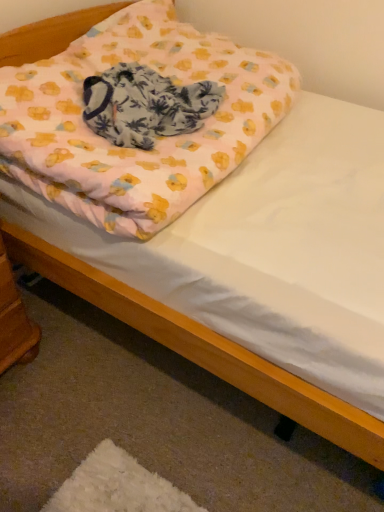
Question: From a real-world perspective, is pink fabric pillow at upper center physically above wooden changing table at lower left?

Choices:
 (A) no
 (B) yes

Answer: (B)

Question: Is pink fabric pillow at upper center not close to wooden changing table at lower left?

Choices:
 (A) yes
 (B) no

Answer: (B)

Question: Can you confirm if pink fabric pillow at upper center is thinner than wooden changing table at lower left?

Choices:
 (A) no
 (B) yes

Answer: (A)

Question: Does pink fabric pillow at upper center lie behind wooden changing table at lower left?

Choices:
 (A) yes
 (B) no

Answer: (B)

Question: Does pink fabric pillow at upper center have a greater height compared to wooden changing table at lower left?

Choices:
 (A) yes
 (B) no

Answer: (B)

Question: Considering the positions of pink fabric blanket at center and wooden changing table at lower left in the image, is pink fabric blanket at center taller or shorter than wooden changing table at lower left?

Choices:
 (A) tall
 (B) short

Answer: (B)

Question: Is pink fabric blanket at center wider or thinner than wooden changing table at lower left?

Choices:
 (A) wide
 (B) thin

Answer: (A)

Question: From a real-world perspective, relative to wooden changing table at lower left, is pink fabric blanket at center vertically above or below?

Choices:
 (A) below
 (B) above

Answer: (B)

Question: From the image's perspective, is pink fabric blanket at center located above or below wooden changing table at lower left?

Choices:
 (A) below
 (B) above

Answer: (B)

Question: From a real-world perspective, relative to pink fabric pillow at upper center, is pink fabric blanket at center vertically above or below?

Choices:
 (A) above
 (B) below

Answer: (A)

Question: From their relative heights in the image, would you say pink fabric blanket at center is taller or shorter than pink fabric pillow at upper center?

Choices:
 (A) tall
 (B) short

Answer: (B)

Question: Would you say pink fabric blanket at center is to the left or to the right of pink fabric pillow at upper center in the picture?

Choices:
 (A) left
 (B) right

Answer: (A)

Question: From the image's perspective, is pink fabric blanket at center positioned above or below pink fabric pillow at upper center?

Choices:
 (A) below
 (B) above

Answer: (A)

Question: Is pink fabric pillow at upper center bigger or smaller than wooden changing table at lower left?

Choices:
 (A) small
 (B) big

Answer: (B)

Question: Considering the positions of pink fabric pillow at upper center and wooden changing table at lower left in the image, is pink fabric pillow at upper center wider or thinner than wooden changing table at lower left?

Choices:
 (A) wide
 (B) thin

Answer: (A)